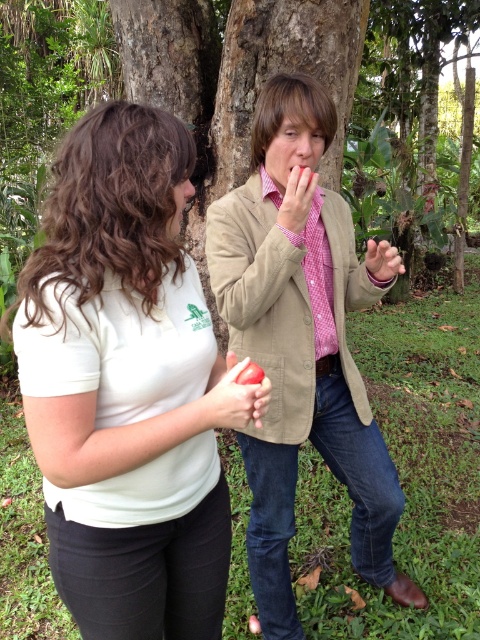
Who is higher up, white matte shirt at center or pink checkered shirt at center?

pink checkered shirt at center is higher up.

Which is more to the right, white matte shirt at center or pink checkered shirt at center?

pink checkered shirt at center

Who is more forward, (x=137, y=122) or (x=410, y=602)?

Point (x=137, y=122)

Where is `white matte shirt at center`? Image resolution: width=480 pixels, height=640 pixels. white matte shirt at center is located at coordinates (123, 385).

Between point (332, 298) and point (300, 204), which one is positioned in front?

Positioned in front is point (300, 204).

Is pink dotted fabric tie at center positioned behind matte pink shirt at center?

Yes, pink dotted fabric tie at center is further from the viewer.

Locate an element on the screen. pink dotted fabric tie at center is located at coordinates (320, 280).

Who is shorter, matte pink shirt at center or matte pink shirt at upper center?

matte pink shirt at upper center

Which is behind, point (297, 180) or point (392, 268)?

Point (392, 268)

Identify the location of matte pink shirt at center. The width and height of the screenshot is (480, 640). (297, 198).